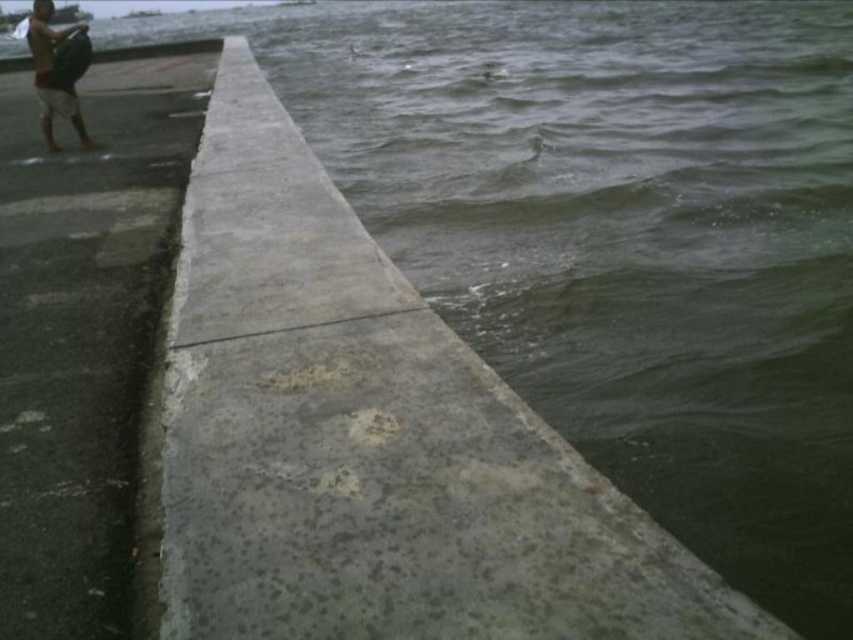
Question: Which point is farther to the camera?

Choices:
 (A) gray concrete pavement at left
 (B) gray concrete at center
 (C) tan skin human at upper left

Answer: (C)

Question: Can you confirm if gray concrete at center is positioned to the left of tan skin human at upper left?

Choices:
 (A) no
 (B) yes

Answer: (A)

Question: Is gray concrete at center closer to camera compared to gray concrete pavement at left?

Choices:
 (A) no
 (B) yes

Answer: (B)

Question: Among these objects, which one is nearest to the camera?

Choices:
 (A) tan skin human at upper left
 (B) gray concrete pavement at left
 (C) gray concrete at center

Answer: (C)

Question: Does gray concrete at center have a lesser width compared to tan skin human at upper left?

Choices:
 (A) yes
 (B) no

Answer: (A)

Question: Considering the real-world distances, which object is farthest from the gray concrete pavement at left?

Choices:
 (A) gray concrete at center
 (B) tan skin human at upper left

Answer: (A)